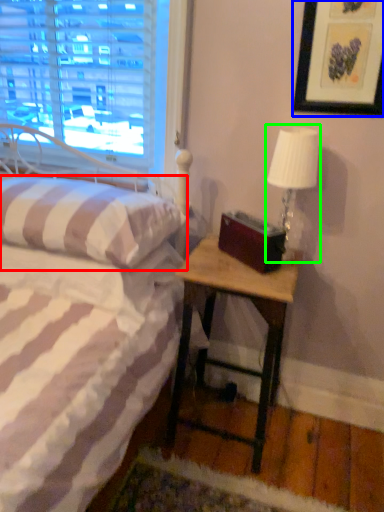
Question: Which object is the closest to the pillow (highlighted by a red box)? Choose among these: picture frame (highlighted by a blue box) or table lamp (highlighted by a green box).

Choices:
 (A) picture frame
 (B) table lamp

Answer: (B)